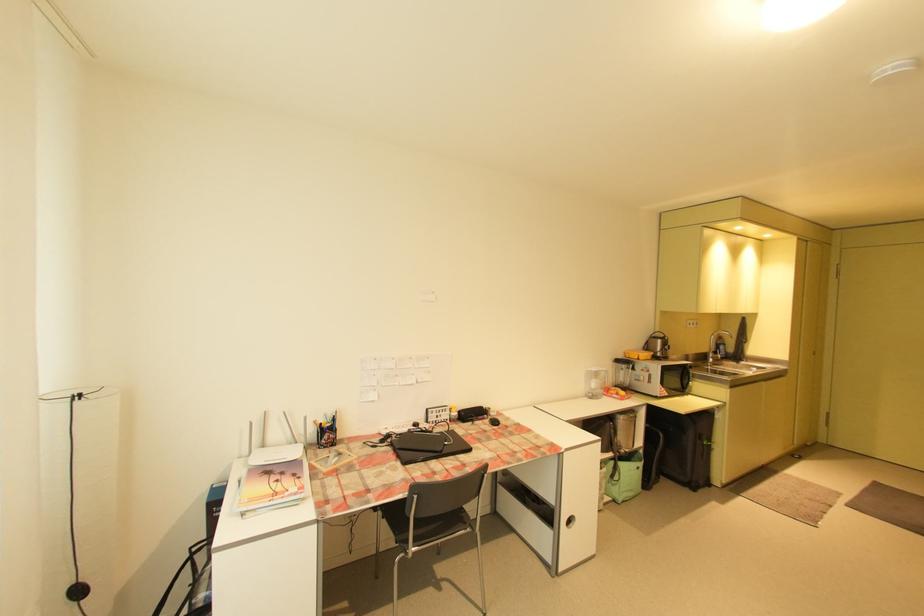
Find where to turn the faucet handle. Please return your answer as a coordinate pair (x, y).

(720, 352)